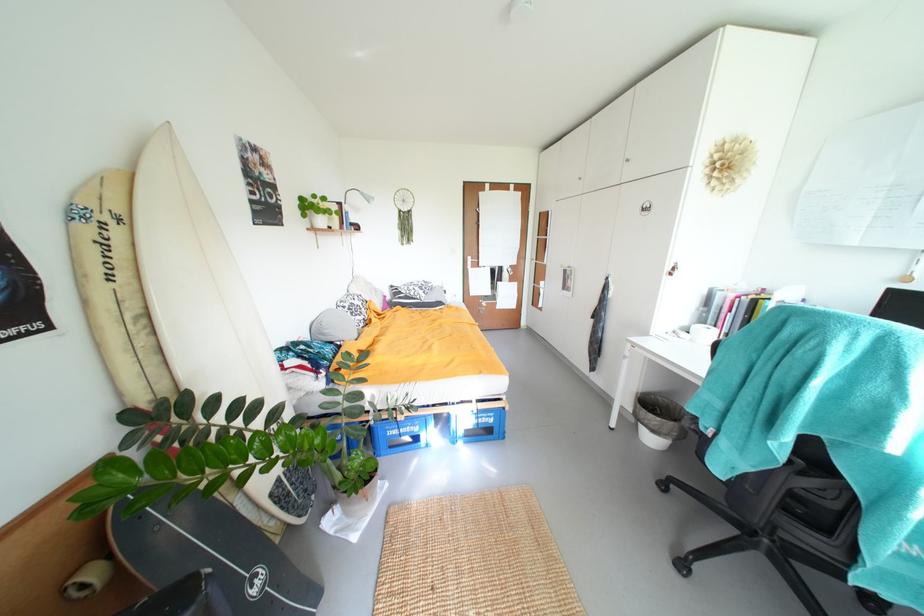
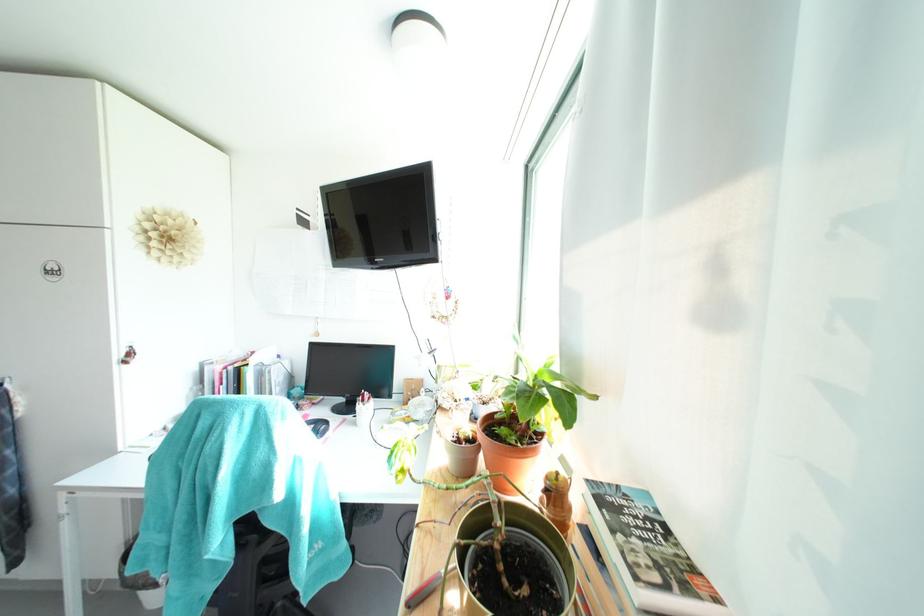
Question: The images are taken continuously from a first-person perspective. In which direction is your viewpoint rotating?

Choices:
 (A) Left
 (B) Right
 (C) Up
 (D) Down

Answer: (B)